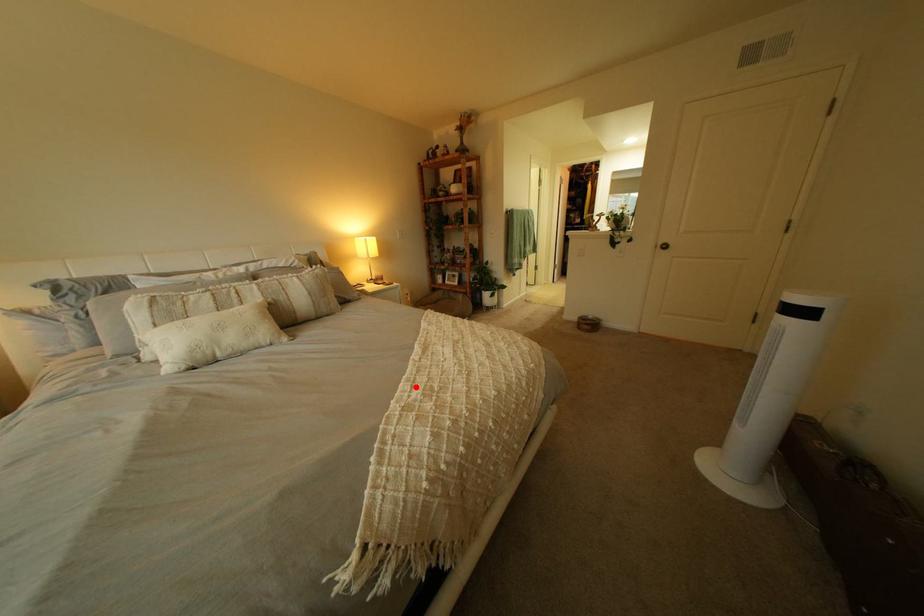
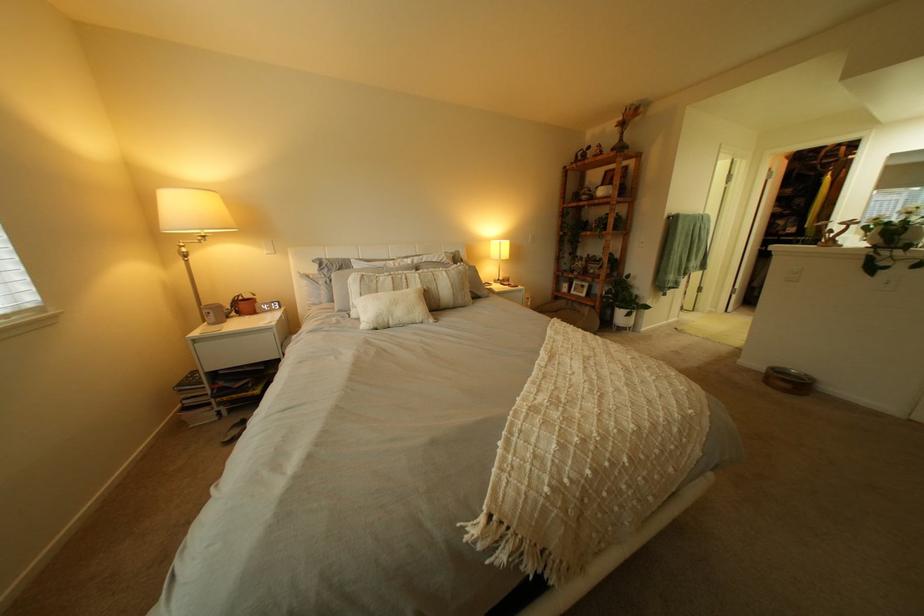
Where in the second image is the point corresponding to the highlighted location from the first image?

(541, 387)